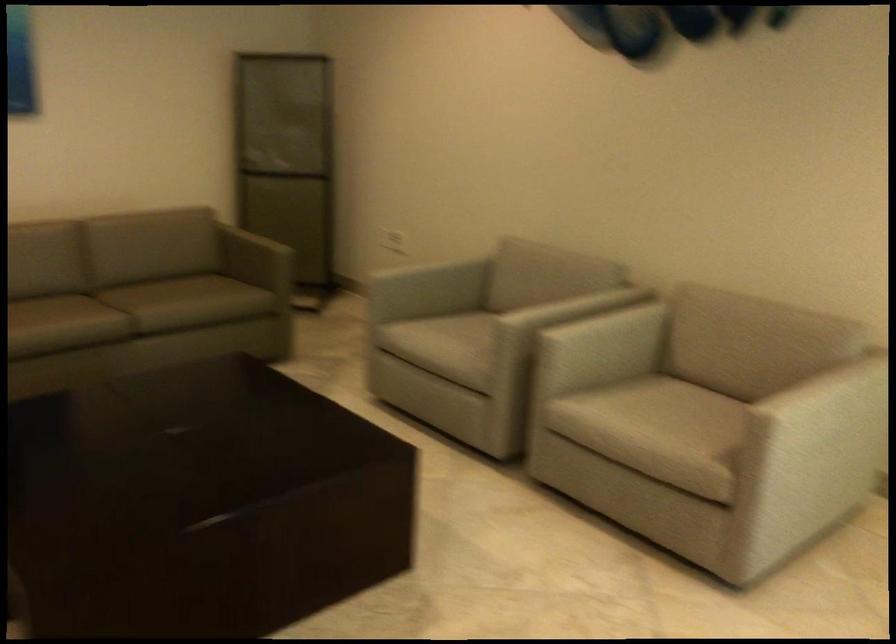
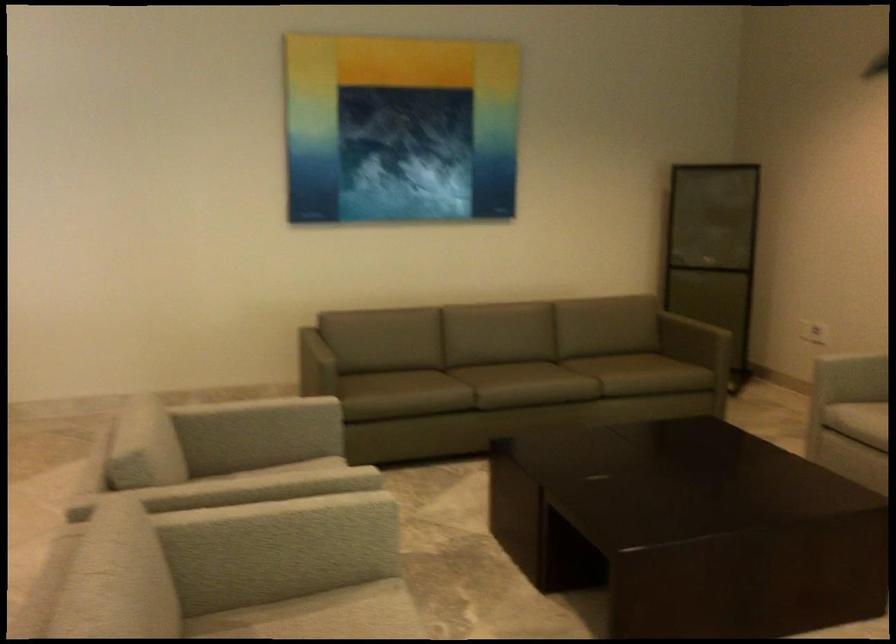
In the second image, find the point that corresponds to pixel 304 228 in the first image.

(713, 317)